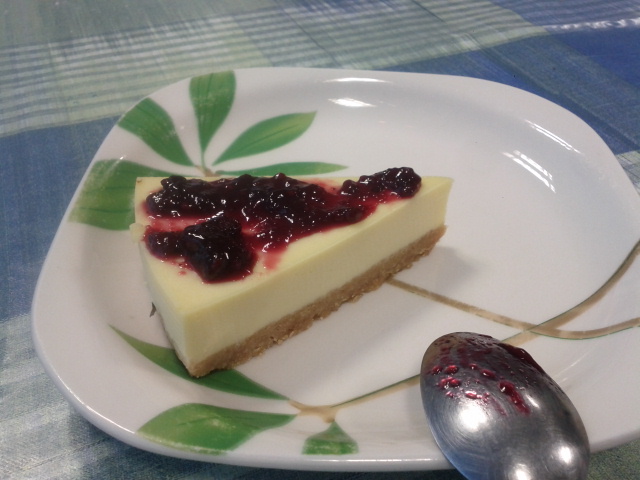
At what (x,y) coordinates should I click in order to perform the action: click on silver spoon. Please return your answer as a coordinate pair (x, y). Looking at the image, I should click on (516, 449).